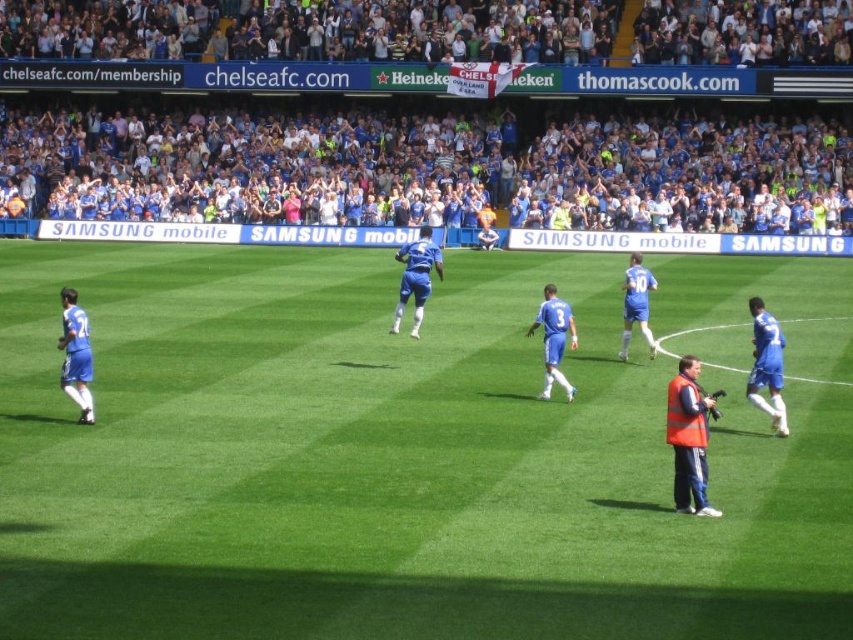
Question: Which object appears farthest from the camera in this image?

Choices:
 (A) blue jersey at center
 (B) blue fabric soccer player at center
 (C) blue jersey at right
 (D) orange reflective vest at lower right

Answer: (A)

Question: Does blue fabric jersey at left lie in front of blue fabric soccer player at center?

Choices:
 (A) no
 (B) yes

Answer: (B)

Question: Is blue smooth soccer player at center positioned behind blue jersey at center?

Choices:
 (A) no
 (B) yes

Answer: (A)

Question: Can you confirm if orange reflective vest at lower right is bigger than blue fabric jersey at left?

Choices:
 (A) yes
 (B) no

Answer: (B)

Question: Which point appears closest to the camera in this image?

Choices:
 (A) (84, 408)
 (B) (764, 410)
 (C) (643, 620)
 (D) (693, 480)

Answer: (C)

Question: Based on their relative distances, which object is farther from the blue jersey crowd at upper center?

Choices:
 (A) blue smooth soccer player at center
 (B) blue jersey at right
 (C) orange reflective vest at lower right

Answer: (C)